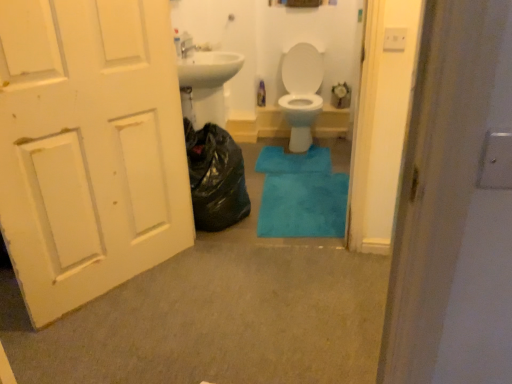
Question: Does blue plush bath mat at center, the 1th bath mat when ordered from bottom to top, turn towards white painted wood door at left?

Choices:
 (A) yes
 (B) no

Answer: (B)

Question: Is white painted wood door at left at the back of blue plush bath mat at center, arranged as the 1th bath mat when viewed from the front?

Choices:
 (A) no
 (B) yes

Answer: (A)

Question: Is blue plush bath mat at center, the 1th bath mat when ordered from bottom to top, in contact with white painted wood door at left?

Choices:
 (A) yes
 (B) no

Answer: (B)

Question: Does blue plush bath mat at center, arranged as the 1th bath mat when viewed from the front, have a greater height compared to white painted wood door at left?

Choices:
 (A) no
 (B) yes

Answer: (A)

Question: Can you confirm if blue plush bath mat at center, arranged as the 1th bath mat when viewed from the front, is thinner than white painted wood door at left?

Choices:
 (A) no
 (B) yes

Answer: (A)

Question: From a real-world perspective, relative to black plastic bag at left, is blue plush bath mat at center, the 1th bath mat positioned from the back, vertically above or below?

Choices:
 (A) above
 (B) below

Answer: (B)

Question: Is blue plush bath mat at center, positioned as the second bath mat in front-to-back order, situated inside black plastic bag at left or outside?

Choices:
 (A) outside
 (B) inside

Answer: (A)

Question: From the image's perspective, relative to black plastic bag at left, is blue plush bath mat at center, positioned as the second bath mat in front-to-back order, above or below?

Choices:
 (A) below
 (B) above

Answer: (B)

Question: Considering their positions, is blue plush bath mat at center, positioned as the second bath mat in front-to-back order, located in front of or behind black plastic bag at left?

Choices:
 (A) front
 (B) behind

Answer: (B)

Question: Is white glossy toilet at center situated inside blue plush bath mat at center, the 1th bath mat when ordered from bottom to top, or outside?

Choices:
 (A) inside
 (B) outside

Answer: (B)

Question: Visually, is white glossy toilet at center positioned to the left or to the right of blue plush bath mat at center, which is the 2th bath mat in back-to-front order?

Choices:
 (A) right
 (B) left

Answer: (A)

Question: From a real-world perspective, is white glossy toilet at center physically located above or below blue plush bath mat at center, the 1th bath mat when ordered from bottom to top?

Choices:
 (A) above
 (B) below

Answer: (A)

Question: Is white glossy toilet at center taller or shorter than blue plush bath mat at center, arranged as the 1th bath mat when viewed from the front?

Choices:
 (A) tall
 (B) short

Answer: (A)

Question: From the image's perspective, is blue plush bath mat at center, the 1th bath mat when ordered from bottom to top, above or below white painted wood door at left?

Choices:
 (A) above
 (B) below

Answer: (B)

Question: Is blue plush bath mat at center, the 1th bath mat when ordered from bottom to top, bigger or smaller than white painted wood door at left?

Choices:
 (A) big
 (B) small

Answer: (B)